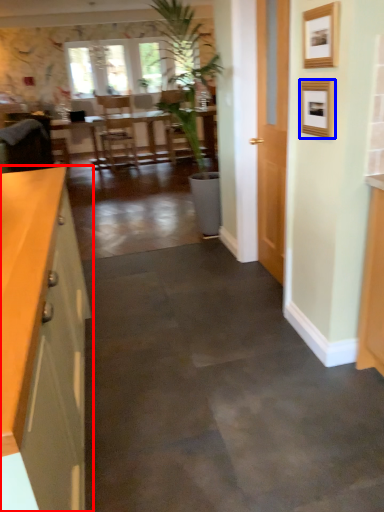
Question: Among these objects, which one is farthest to the camera, cabinetry (highlighted by a red box) or picture frame (highlighted by a blue box)?

Choices:
 (A) cabinetry
 (B) picture frame

Answer: (B)